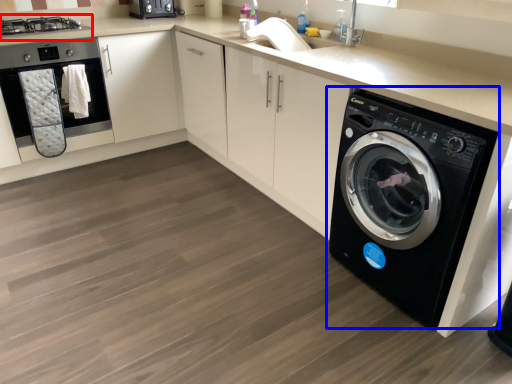
Question: Which of the following is the closest to the observer, stove (highlighted by a red box) or washing machine (highlighted by a blue box)?

Choices:
 (A) stove
 (B) washing machine

Answer: (B)